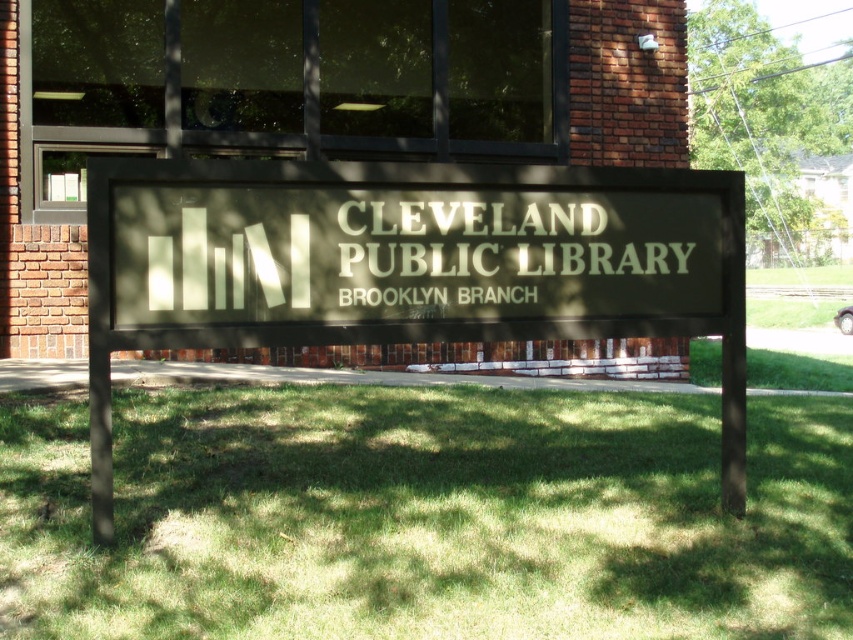
In the scene shown: Does green grass at center have a smaller size compared to matte black sign at center?

Indeed, green grass at center has a smaller size compared to matte black sign at center.

Does green grass at center appear under matte black sign at center?

Indeed, green grass at center is positioned under matte black sign at center.

Image resolution: width=853 pixels, height=640 pixels. Find the location of `green grass at center`. green grass at center is located at coordinates (424, 515).

What are the coordinates of `green grass at center` in the screenshot? It's located at (424, 515).